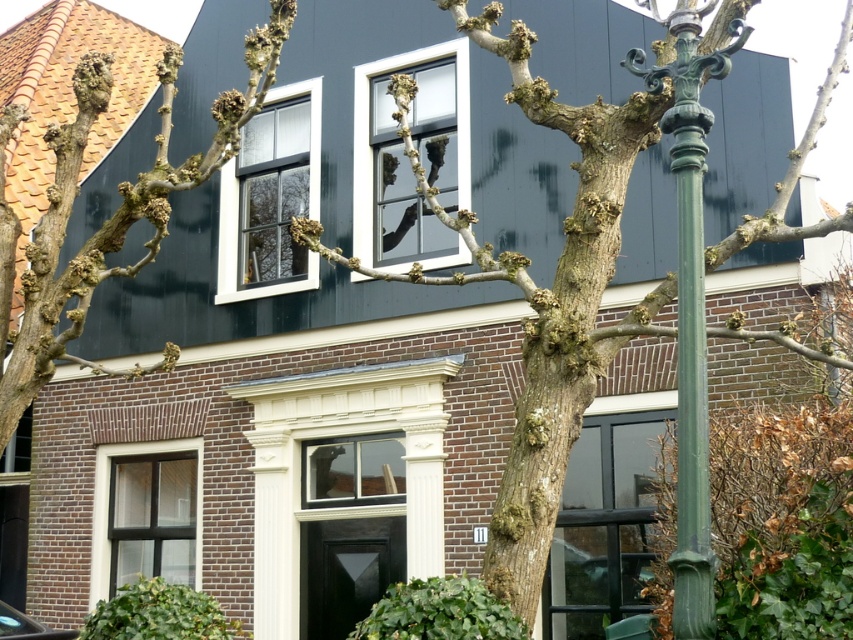
You are an architect analyzing the spatial layout of the house. You need to determine if the bark textured tree at center will fit through a narrow pathway that can only accommodate objects narrower than the bare branches at upper left. Based on the scene description, can the tree pass through the pathway?

The bark textured tree at center has a width less than the bare branches at upper left. Therefore, the tree can pass through the pathway since its width is narrower than the required clearance provided by the branches.

You are standing in front of the traditional house and notice the bark textured tree at center and the bare branches at upper left. Which object is closer to the right side of your view?

The bark textured tree at center is positioned on the right side of bare branches at upper left, so it is closer to the right side of your view.